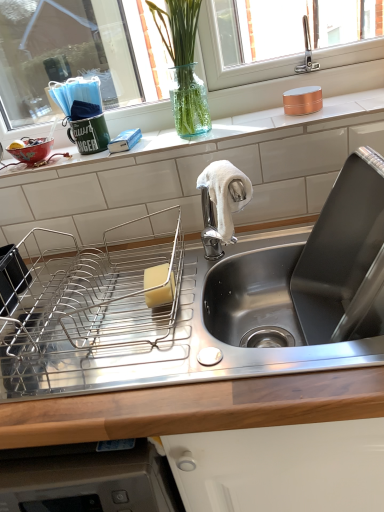
Question: Is matte ceramic bowl at left bigger than stainless steel sink at upper right?

Choices:
 (A) no
 (B) yes

Answer: (A)

Question: Is stainless steel sink at upper right completely or partially inside matte ceramic bowl at left?

Choices:
 (A) yes
 (B) no

Answer: (B)

Question: Is matte ceramic bowl at left wider than stainless steel sink at upper right?

Choices:
 (A) yes
 (B) no

Answer: (B)

Question: Considering the relative positions of matte ceramic bowl at left and stainless steel sink at upper right in the image provided, is matte ceramic bowl at left to the left of stainless steel sink at upper right from the viewer's perspective?

Choices:
 (A) no
 (B) yes

Answer: (B)

Question: Is matte ceramic bowl at left not inside stainless steel sink at upper right?

Choices:
 (A) yes
 (B) no

Answer: (A)

Question: Relative to copper metallic canister at upper right, positioned as the 1th appliance in right-to-left order, is metallic wire dish rack at center-left, acting as the 1th appliance starting from the bottom, in front or behind?

Choices:
 (A) front
 (B) behind

Answer: (A)

Question: Does point (142, 219) appear closer or farther from the camera than point (319, 90)?

Choices:
 (A) closer
 (B) farther

Answer: (B)

Question: From the image's perspective, relative to copper metallic canister at upper right, positioned as the first appliance in top-to-bottom order, is metallic wire dish rack at center-left, acting as the 1th appliance starting from the bottom, above or below?

Choices:
 (A) below
 (B) above

Answer: (A)

Question: Considering the positions of metallic wire dish rack at center-left, the second appliance in the top-to-bottom sequence, and copper metallic canister at upper right, arranged as the second appliance when viewed from the left, in the image, is metallic wire dish rack at center-left, the second appliance in the top-to-bottom sequence, bigger or smaller than copper metallic canister at upper right, arranged as the second appliance when viewed from the left,?

Choices:
 (A) big
 (B) small

Answer: (A)

Question: Does point (155, 270) appear closer or farther from the camera than point (220, 170)?

Choices:
 (A) closer
 (B) farther

Answer: (B)

Question: Considering the relative positions of yellow sponge at sink and white soft towel at center in the image provided, is yellow sponge at sink to the left or to the right of white soft towel at center?

Choices:
 (A) left
 (B) right

Answer: (A)

Question: From a real-world perspective, relative to white soft towel at center, is yellow sponge at sink vertically above or below?

Choices:
 (A) above
 (B) below

Answer: (B)

Question: From the image's perspective, is yellow sponge at sink located above or below white soft towel at center?

Choices:
 (A) above
 (B) below

Answer: (B)

Question: Is point (190, 22) closer or farther from the camera than point (332, 335)?

Choices:
 (A) closer
 (B) farther

Answer: (B)

Question: Is transparent glass vase at upper center taller or shorter than stainless steel sink at upper right?

Choices:
 (A) tall
 (B) short

Answer: (B)